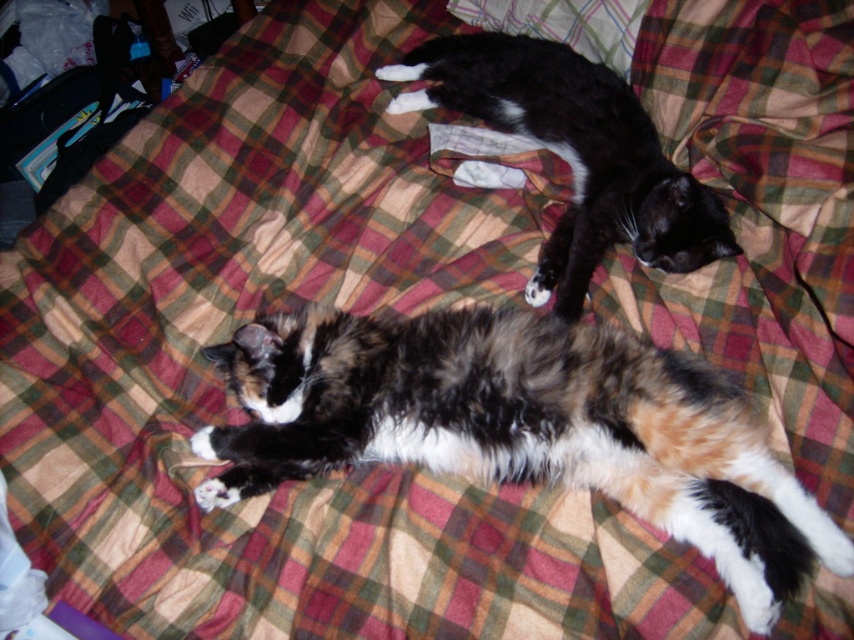
From the picture: You are a photographer trying to capture both cats in a single shot. Since the calico fur cat at center is closer to the camera, will it appear larger in the photo than the black fur cat at upper center?

The calico fur cat at center has a lesser height compared to black fur cat at upper center, but since it is closer to the camera, it might still appear larger in the photo depending on the camera angle and distance.

You are standing at the edge of the bed and want to place a small toy exactly at the point marked as point (x=524, y=428). Which cat is closest to this point?

The point (x=524, y=428) corresponds to the calico fur cat at center, so the calico fur cat at center is closest to this point.